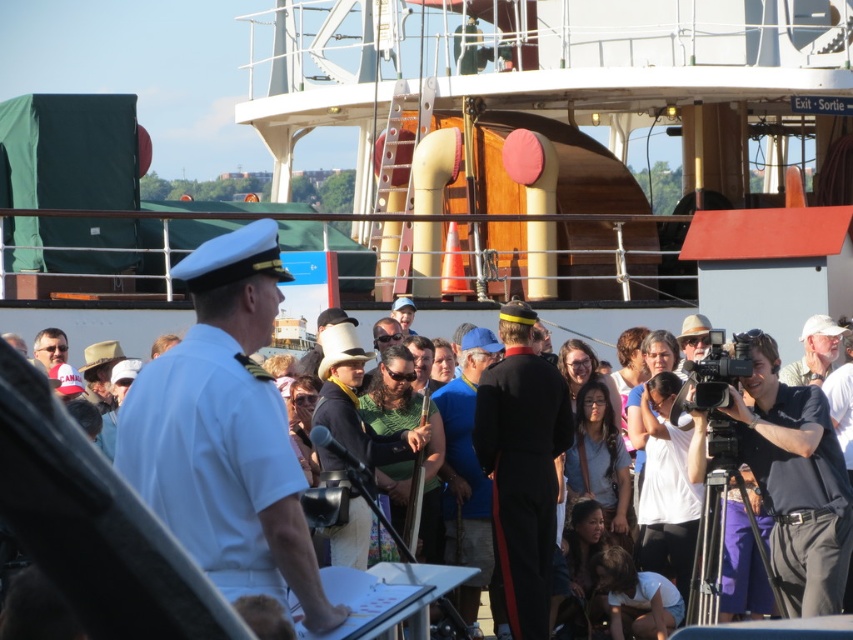
Can you confirm if blue fabric shirt at center is thinner than matte white cap at center?

In fact, blue fabric shirt at center might be wider than matte white cap at center.

Does blue fabric shirt at center lie in front of matte white cap at center?

Yes, it is.

Is point (461, 362) more distant than point (392, 308)?

No, (461, 362) is in front of (392, 308).

I want to click on blue fabric shirt at center, so click(x=466, y=472).

Does black uniform at center appear over gray fabric cap at right?

No, black uniform at center is not above gray fabric cap at right.

Is black uniform at center to the left of gray fabric cap at right from the viewer's perspective?

Correct, you'll find black uniform at center to the left of gray fabric cap at right.

Which is behind, point (503, 384) or point (820, 326)?

The point (820, 326) is behind.

Identify the location of black uniform at center. The width and height of the screenshot is (853, 640). (521, 467).

From the picture: Can you confirm if white uniform at center is positioned to the right of green fabric shirt at center?

In fact, white uniform at center is to the left of green fabric shirt at center.

Between point (311, 602) and point (323, 442), which one is positioned behind?

Positioned behind is point (323, 442).

This screenshot has width=853, height=640. I want to click on white uniform at center, so click(225, 433).